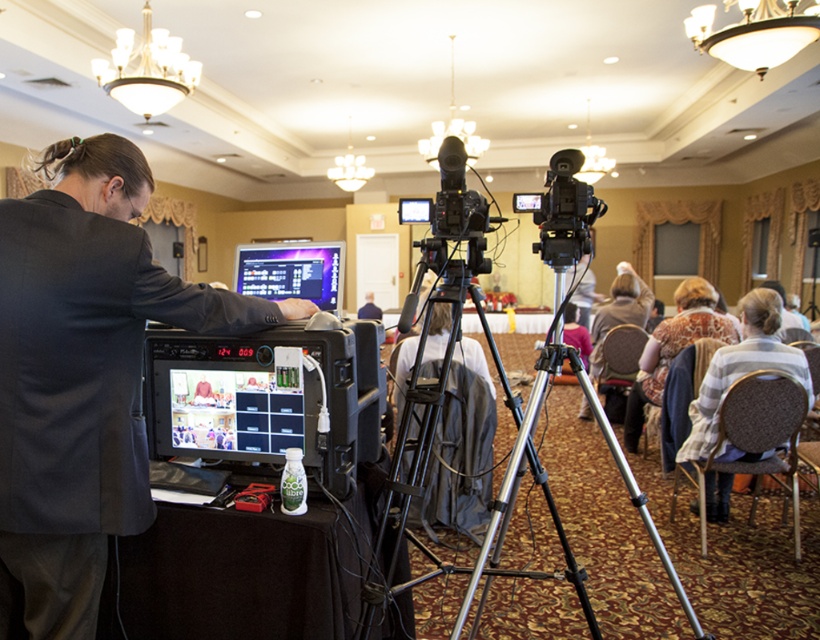
You are standing in the video production setup and need to locate the dark gray fabric business suit at left. According to the coordinates provided, where exactly is it positioned in the image?

The dark gray fabric business suit at left is positioned at coordinates point [80,396].

You are an event technician who needs to adjust the focus of the black plastic video camera at center. You are currently standing in front of the brown fabric chair at center. Can you reach the camera without moving from your current position?

The black plastic video camera at center is further to the viewer than the brown fabric chair at center, so you are already in front of it and can adjust the focus without moving.

You are a technician in the conference room. You need to access the black plastic video camera at center for adjustments. However, the dark gray fabric business suit at left is blocking your path. Can you move around the suit to reach the camera without disturbing the setup?

The dark gray fabric business suit at left is in front of the black plastic video camera at center, so you can move around either the left or right side of the dark gray fabric business suit at left to access the camera without disturbing the setup.